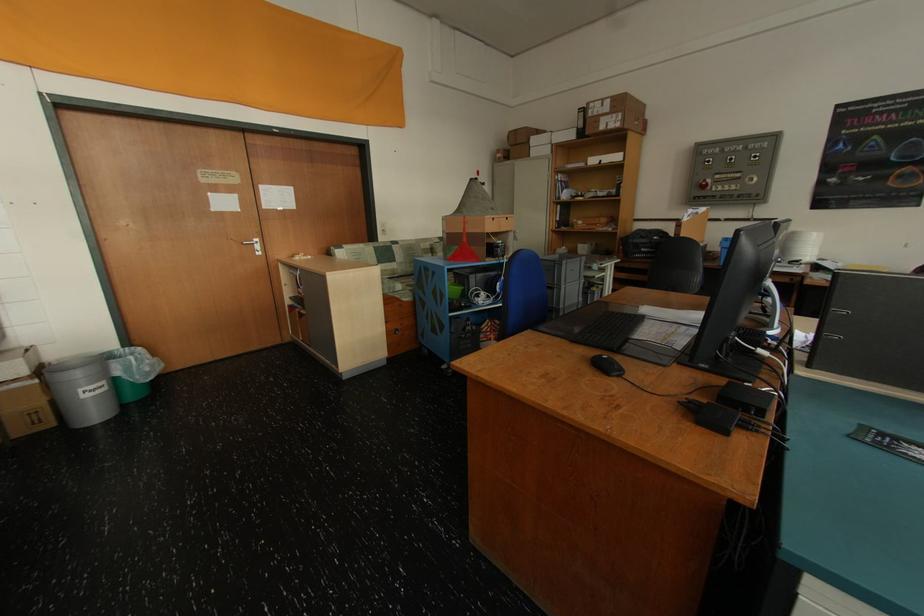
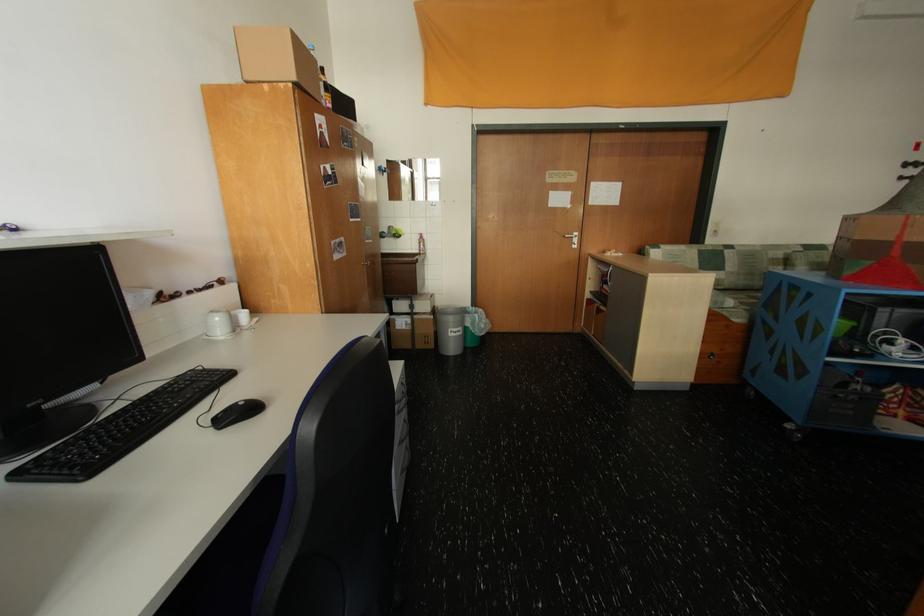
Question: The camera is either moving clockwise (left) or counter-clockwise (right) around the object. The first image is from the beginning of the video and the second image is from the end. Is the camera moving left or right when shooting the video?

Choices:
 (A) Left
 (B) Right

Answer: (B)